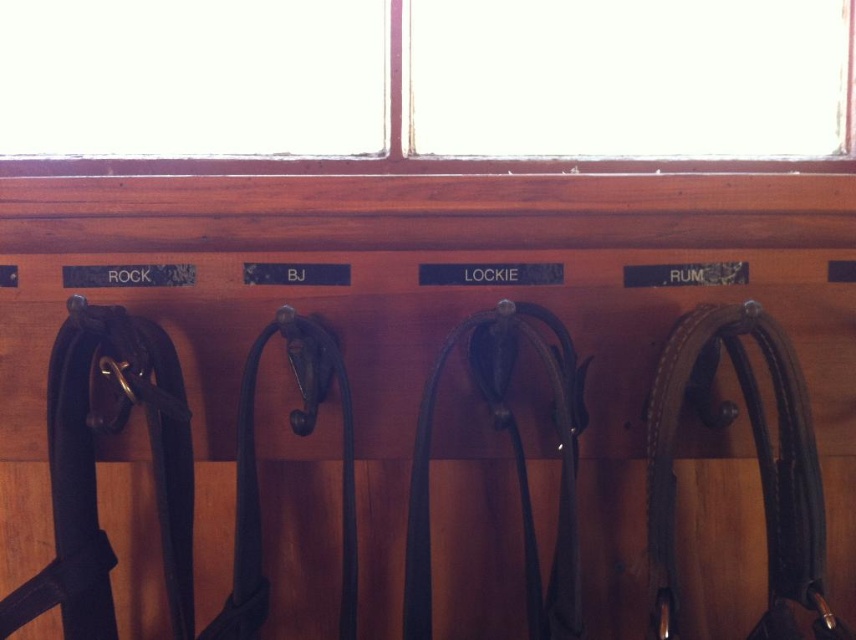
Question: Which of these objects is positioned closest to the black leather strap at center?

Choices:
 (A) leather strap at right
 (B) clear glass window at upper center

Answer: (A)

Question: Is leather strap at right smaller than clear glass window at upper center?

Choices:
 (A) yes
 (B) no

Answer: (A)

Question: Which object is positioned farthest from the leather strap at right?

Choices:
 (A) clear glass window at upper center
 (B) black leather strap at center

Answer: (A)

Question: Observing the image, what is the correct spatial positioning of leather strap at right in reference to black leather strap at center?

Choices:
 (A) above
 (B) below

Answer: (A)

Question: Is leather strap at right smaller than clear glass window at upper center?

Choices:
 (A) yes
 (B) no

Answer: (A)

Question: Among these objects, which one is farthest from the camera?

Choices:
 (A) leather strap at right
 (B) black leather strap at center
 (C) clear glass window at upper center

Answer: (C)